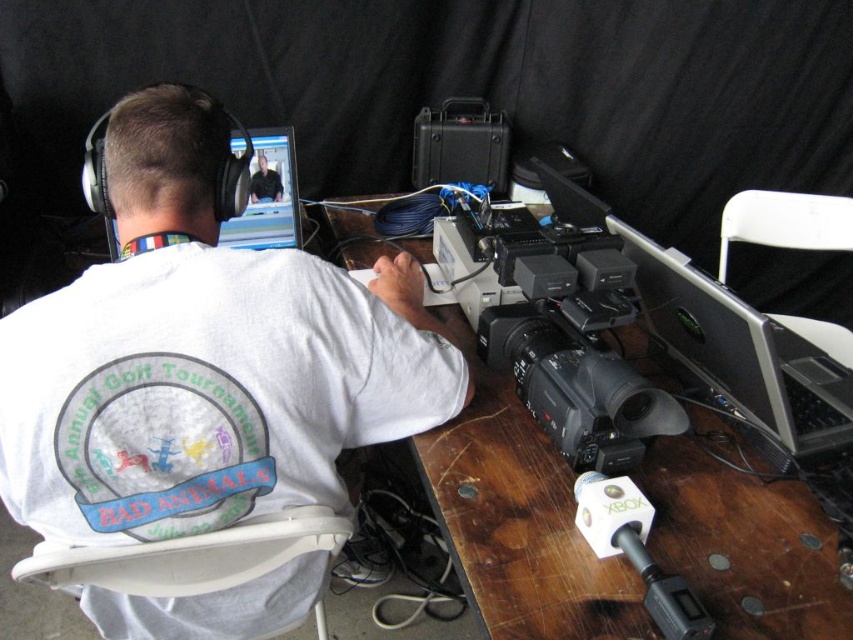
You are a technician trying to adjust the camera position to focus on a specific point. The point you need to focus on is at coordinates point (538,337). The camera is currently positioned 1.5 meters away from this point. How much closer should you move the camera to achieve the desired focus distance of 1.23 meters?

The camera needs to be moved closer by 0.27 meters to reach the desired distance of 1.23 meters from the point (538,337). Subtract the desired distance from the current distance to get the adjustment needed.